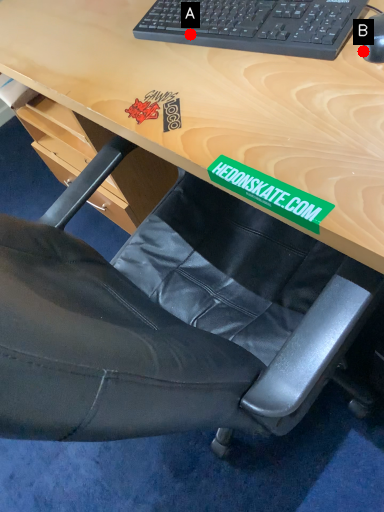
Question: Two points are circled on the image, labeled by A and B beside each circle. Which point is closer to the camera?

Choices:
 (A) A is closer
 (B) B is closer

Answer: (B)